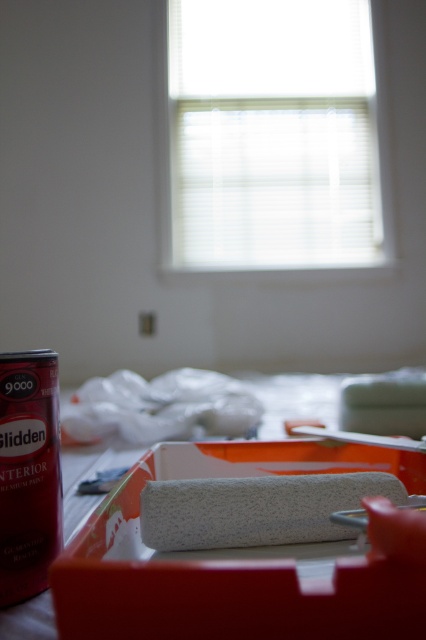
Question: Which point is closer to the camera?

Choices:
 (A) white textured paint roller at lower center
 (B) white textured roller at center

Answer: (B)

Question: Does white textured roller at center come in front of white textured paint roller at lower center?

Choices:
 (A) no
 (B) yes

Answer: (B)

Question: Can you confirm if white textured roller at center is positioned to the right of white textured paint roller at lower center?

Choices:
 (A) no
 (B) yes

Answer: (A)

Question: Can you confirm if white textured roller at center is bigger than white textured paint roller at lower center?

Choices:
 (A) yes
 (B) no

Answer: (B)